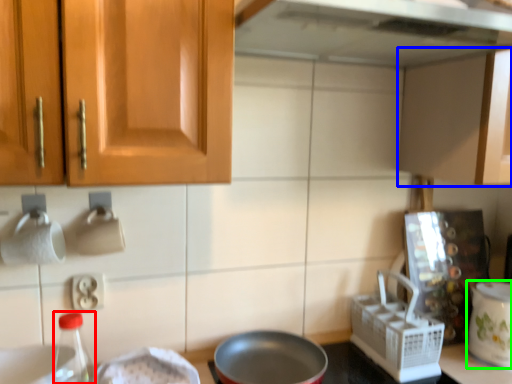
Question: Estimate the real-world distances between objects in this image. Which object is closer to bottle (highlighted by a red box), cabinetry (highlighted by a blue box) or kitchen appliance (highlighted by a green box)?

Choices:
 (A) cabinetry
 (B) kitchen appliance

Answer: (A)